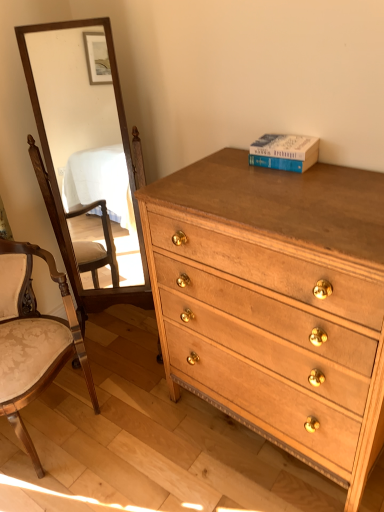
Question: From the image's perspective, is light brown wood chest of drawers at center positioned above or below blue hardcover book at upper right?

Choices:
 (A) above
 (B) below

Answer: (B)

Question: Looking at their shapes, would you say light brown wood chest of drawers at center is wider or thinner than blue hardcover book at upper right?

Choices:
 (A) thin
 (B) wide

Answer: (B)

Question: Considering the real-world distances, which object is closest to the wooden mirror at left?

Choices:
 (A) light brown wood chest of drawers at center
 (B) blue hardcover book at upper right
 (C) wooden upholstered chair at left

Answer: (C)

Question: Estimate the real-world distances between objects in this image. Which object is farther from the wooden upholstered chair at left?

Choices:
 (A) blue hardcover book at upper right
 (B) wooden mirror at left
 (C) light brown wood chest of drawers at center

Answer: (B)